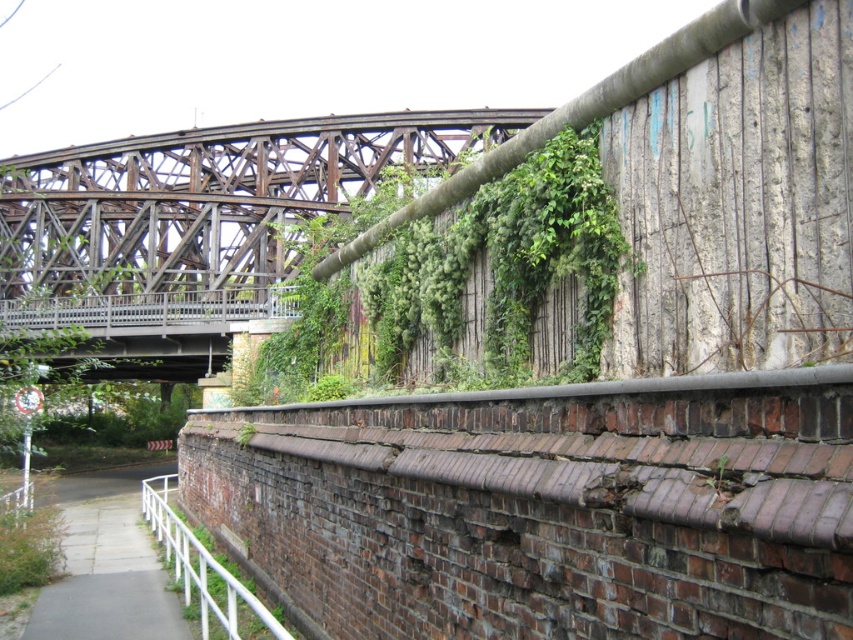
Question: Which object is farther from the camera taking this photo?

Choices:
 (A) white metal rail at lower left
 (B) gray concrete sidewalk at lower left

Answer: (B)

Question: Is gray concrete sidewalk at lower left below white metal rail at lower left?

Choices:
 (A) no
 (B) yes

Answer: (B)

Question: Is gray concrete sidewalk at lower left positioned behind white metal rail at lower left?

Choices:
 (A) yes
 (B) no

Answer: (A)

Question: Does gray concrete sidewalk at lower left come in front of white metal rail at lower left?

Choices:
 (A) no
 (B) yes

Answer: (A)

Question: Which point appears farthest from the camera in this image?

Choices:
 (A) (149, 572)
 (B) (267, 634)

Answer: (A)

Question: Which point is farther to the camera?

Choices:
 (A) white metal rail at lower left
 (B) gray concrete sidewalk at lower left

Answer: (B)